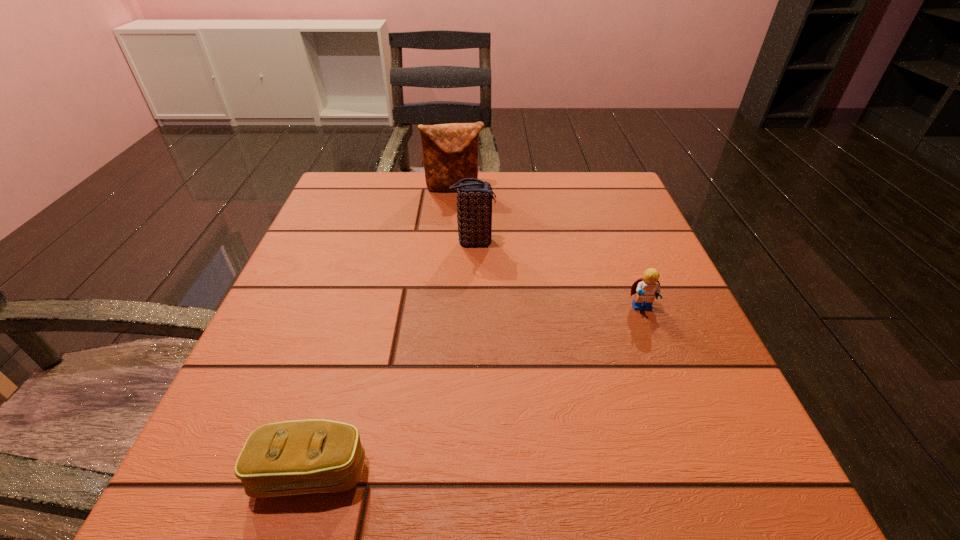
Locate which clutch bag is the second closest to the shortest object. Please provide its 2D coordinates. Your answer should be formatted as a tuple, i.e. [(x, y)], where the tuple contains the x and y coordinates of a point satisfying the conditions above.

[(450, 151)]

Where is `clutch bag that is the closest one to the farthest clutch bag`? The image size is (960, 540). clutch bag that is the closest one to the farthest clutch bag is located at coordinates (474, 199).

At what (x,y) coordinates should I click in order to perform the action: click on free space that satisfies the following two spatial constraints: 1. with the zip open on the second farthest object; 2. on the zipper side of the shortest clutch bag. Please return your answer as a coordinate pair (x, y). The image size is (960, 540). Looking at the image, I should click on (469, 472).

What are the coordinates of `vacant region that satisfies the following two spatial constraints: 1. with the zip open on the second nearest clutch bag; 2. on the zipper side of the nearest clutch bag` in the screenshot? It's located at (469, 472).

I want to click on blank space that satisfies the following two spatial constraints: 1. with the zip open on the second farthest clutch bag; 2. on the zipper side of the shortest clutch bag, so click(469, 472).

This screenshot has width=960, height=540. I want to click on vacant region that satisfies the following two spatial constraints: 1. with the zip open on the second nearest clutch bag; 2. on the zipper side of the nearest clutch bag, so click(469, 472).